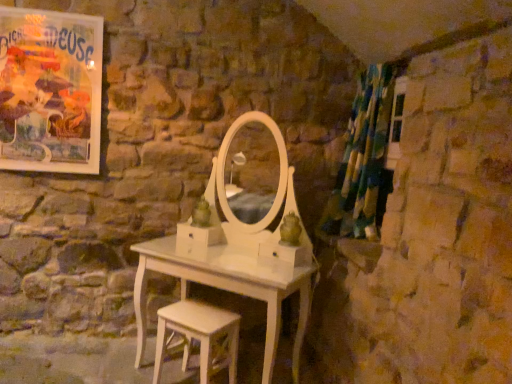
Question: In terms of height, does white wood stool at lower center look taller or shorter compared to matte paper poster at upper left?

Choices:
 (A) short
 (B) tall

Answer: (A)

Question: From a real-world perspective, relative to matte paper poster at upper left, is white wood stool at lower center vertically above or below?

Choices:
 (A) below
 (B) above

Answer: (A)

Question: Considering the real-world distances, which object is farthest from the matte paper poster at upper left?

Choices:
 (A) white wood stool at lower center
 (B) green and blue fabric shower curtain at right

Answer: (B)

Question: Which is nearer to the white wood stool at lower center?

Choices:
 (A) matte paper poster at upper left
 (B) green and blue fabric shower curtain at right

Answer: (B)